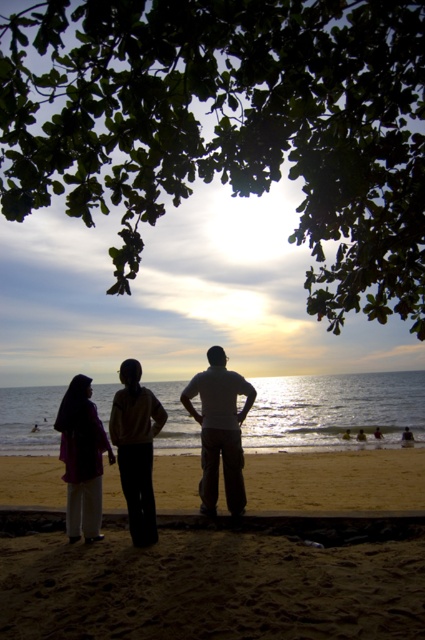
Question: Is green leafy tree at upper center below white cotton shirt at center?

Choices:
 (A) no
 (B) yes

Answer: (A)

Question: Which object is farther from the camera taking this photo?

Choices:
 (A) smooth golden sand at lower center
 (B) sandy beach at lower center
 (C) white cotton shirt at center
 (D) silhouette clothing at center

Answer: (A)

Question: Can you confirm if green leafy tree at upper center is positioned to the left of smooth golden sand at lower center?

Choices:
 (A) no
 (B) yes

Answer: (B)

Question: Which point is closer to the camera taking this photo?

Choices:
 (A) (286, 492)
 (B) (235, 410)

Answer: (B)

Question: Can you confirm if sandy beach at lower center is wider than smooth golden sand at lower center?

Choices:
 (A) no
 (B) yes

Answer: (A)

Question: Which object appears farthest from the camera in this image?

Choices:
 (A) sandy beach at lower center
 (B) white cotton shirt at center

Answer: (B)